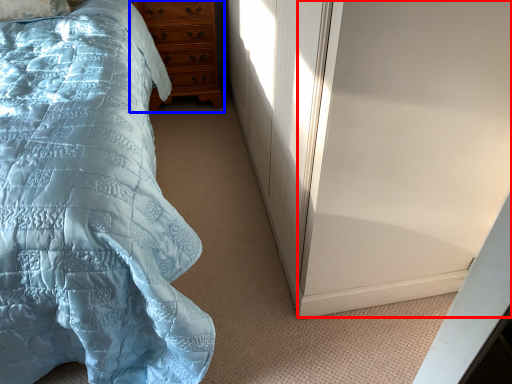
Question: Which object appears closest to the camera in this image, screen door (highlighted by a red box) or chest of drawers (highlighted by a blue box)?

Choices:
 (A) screen door
 (B) chest of drawers

Answer: (A)